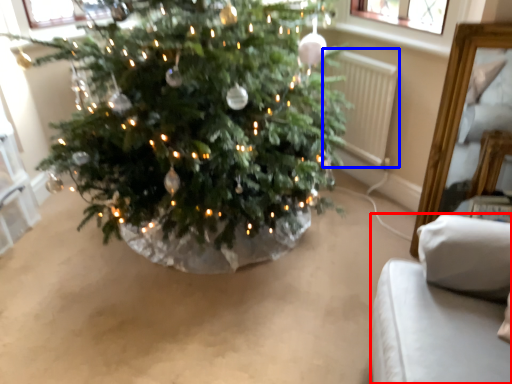
Question: Among these objects, which one is farthest to the camera, furniture (highlighted by a red box) or radiator (highlighted by a blue box)?

Choices:
 (A) furniture
 (B) radiator

Answer: (B)